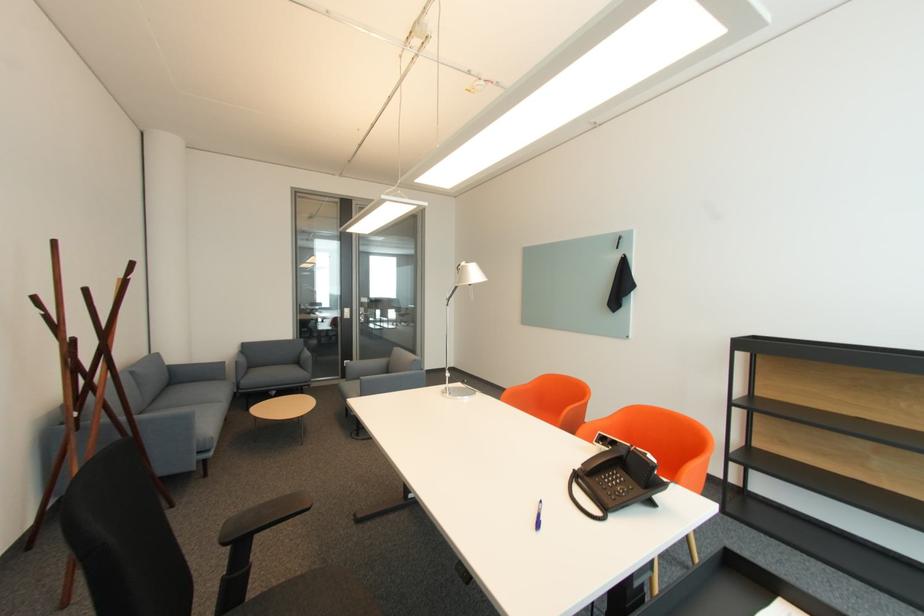
Find the location of a particular element. This screenshot has width=924, height=616. coat rack peg is located at coordinates (87, 361).